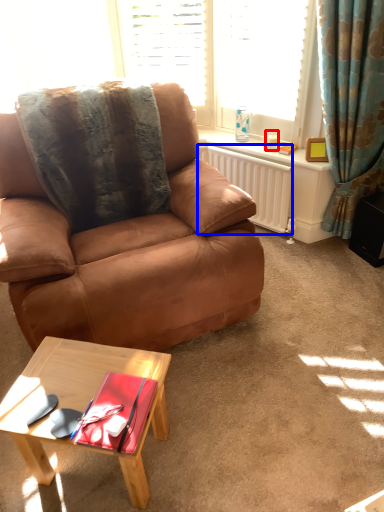
Question: Which of the following is the closest to the observer, coffee cup (highlighted by a red box) or radiator (highlighted by a blue box)?

Choices:
 (A) coffee cup
 (B) radiator

Answer: (B)